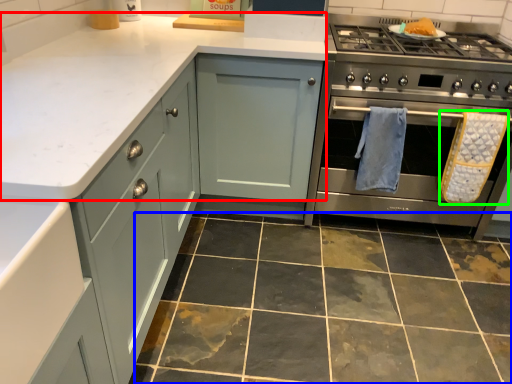
Question: Which object is the farthest from counter top (highlighted by a red box)? Choose among these: ceramic tile (highlighted by a blue box) or bath towel (highlighted by a green box).

Choices:
 (A) ceramic tile
 (B) bath towel

Answer: (B)